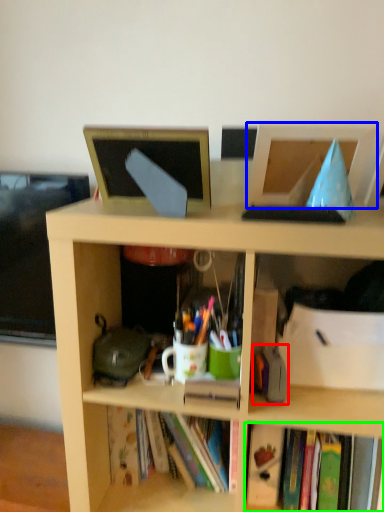
Question: Which is nearer to the stationery (highlighted by a red box)? computer monitor (highlighted by a blue box) or book (highlighted by a green box).

Choices:
 (A) computer monitor
 (B) book

Answer: (B)